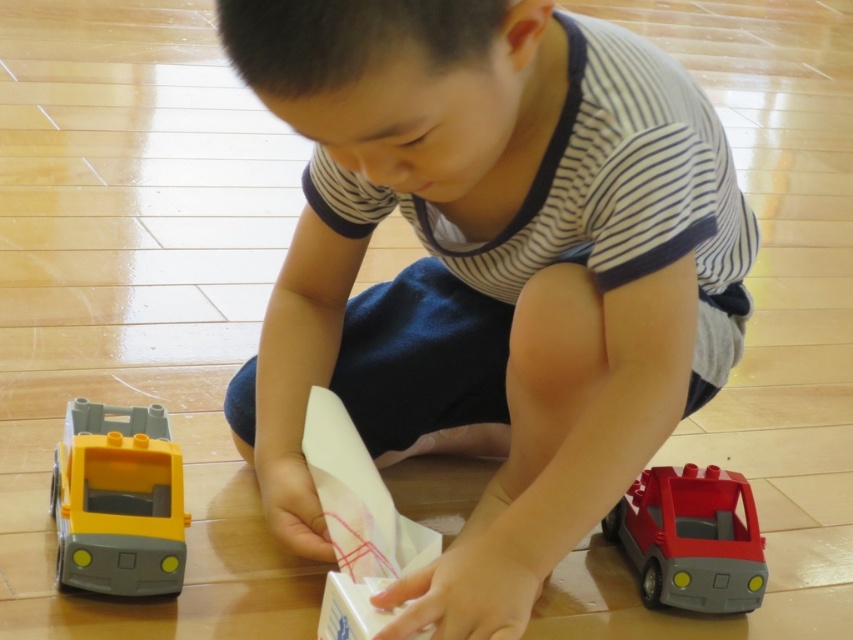
In the scene shown: You are a parent trying to organize the toys. The matte plastic boy at center and the matte red plastic toy car at lower right are on the floor. If you want to place them side by side on a shelf, which toy should you place on the left to match their current positions?

The matte plastic boy at center should be placed on the left side of the matte red plastic toy car at lower right to maintain their current positioning.

You are trying to fit both the matte plastic boy at center and the matte red plastic toy car at lower right into a storage box that can only hold items up to 15 cm in width. Given that the combined width of both items is 28 cm, can they both fit if placed side by side?

The combined width of the matte plastic boy at center and the matte red plastic toy car at lower right is 28 cm, which exceeds the storage box capacity of 15 cm. Therefore, they cannot both fit side by side.